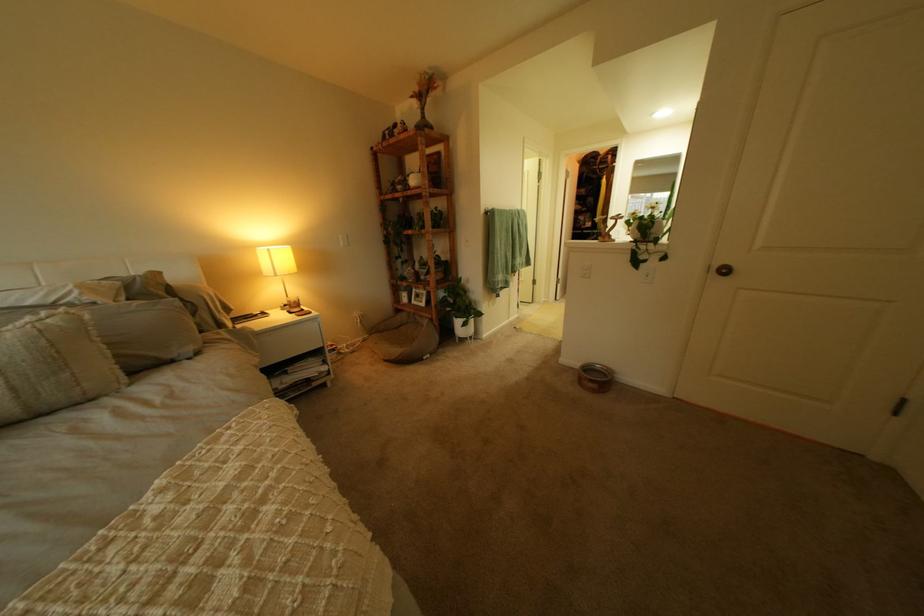
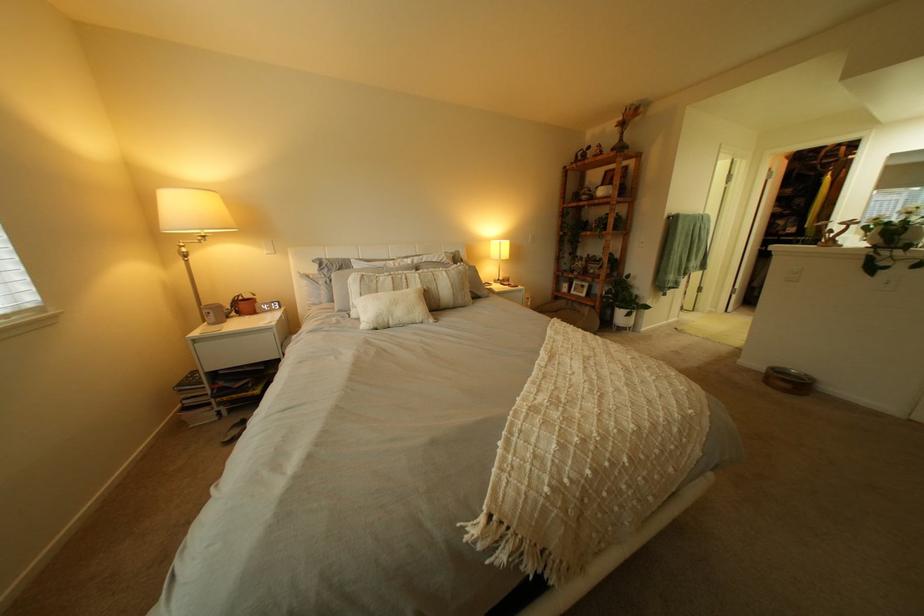
The images are taken continuously from a first-person perspective. In which direction are you moving?

The cameraman walked toward left, backward.